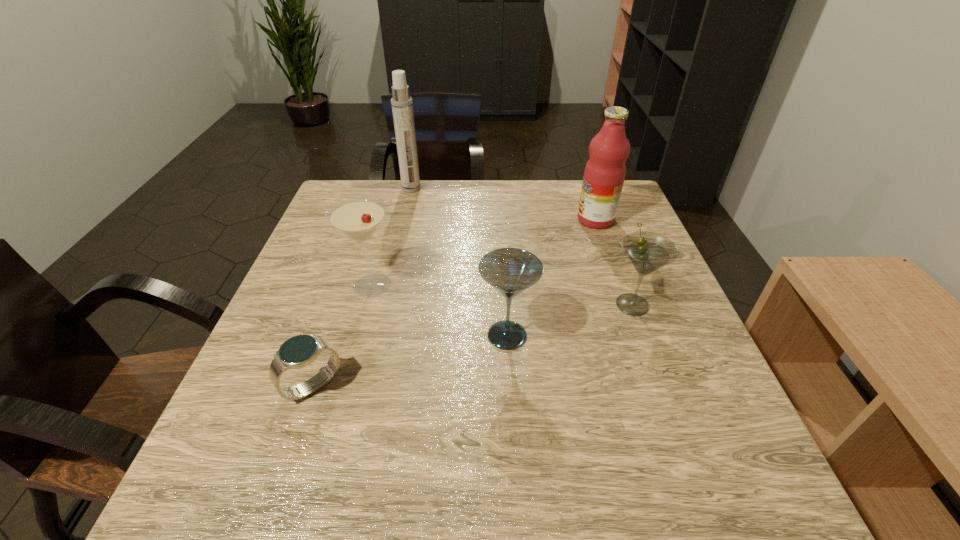
Locate an element on the screen. Image resolution: width=960 pixels, height=540 pixels. unoccupied area between the fruit juice and the rightmost martini is located at coordinates (614, 262).

Locate an element on the screen. This screenshot has height=540, width=960. free spot between the fruit juice and the leftmost martini is located at coordinates (484, 252).

I want to click on free space between the aerosol can and the fifth nearest object, so click(x=503, y=204).

The height and width of the screenshot is (540, 960). I want to click on empty space that is in between the aerosol can and the fruit juice, so click(503, 204).

At what (x,y) coordinates should I click in order to perform the action: click on free point between the leftmost martini and the nearest object. Please return your answer as a coordinate pair (x, y). Looking at the image, I should click on (343, 336).

Find the location of a particular element. The width and height of the screenshot is (960, 540). free area in between the leftmost martini and the watch is located at coordinates (343, 336).

The width and height of the screenshot is (960, 540). I want to click on free space between the farthest object and the leftmost martini, so click(x=392, y=237).

The width and height of the screenshot is (960, 540). I want to click on object that stands as the fifth closest to the aerosol can, so click(301, 350).

In order to click on object that is the second closest to the shortest object in this screenshot , I will do `click(510, 271)`.

Image resolution: width=960 pixels, height=540 pixels. What are the coordinates of `martini that stands as the second closest to the shortest object` in the screenshot? It's located at (510, 271).